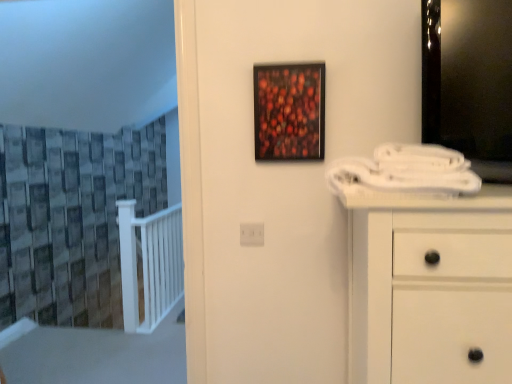
Question: Is white plastic electric outlet at center at the back of wooden-framed artwork at center?

Choices:
 (A) yes
 (B) no

Answer: (B)

Question: Is wooden-framed artwork at center wider than white plastic electric outlet at center?

Choices:
 (A) no
 (B) yes

Answer: (B)

Question: Is wooden-framed artwork at center thinner than white plastic electric outlet at center?

Choices:
 (A) no
 (B) yes

Answer: (A)

Question: Is wooden-framed artwork at center taller than white plastic electric outlet at center?

Choices:
 (A) no
 (B) yes

Answer: (B)

Question: From the image's perspective, is wooden-framed artwork at center beneath white plastic electric outlet at center?

Choices:
 (A) no
 (B) yes

Answer: (A)

Question: Do you think wooden-framed artwork at center is within white plastic electric outlet at center, or outside of it?

Choices:
 (A) outside
 (B) inside

Answer: (A)

Question: Considering the relative positions of wooden-framed artwork at center and white plastic electric outlet at center in the image provided, is wooden-framed artwork at center to the left or to the right of white plastic electric outlet at center?

Choices:
 (A) right
 (B) left

Answer: (A)

Question: Relative to white plastic electric outlet at center, is wooden-framed artwork at center in front or behind?

Choices:
 (A) behind
 (B) front

Answer: (B)

Question: Based on their sizes in the image, would you say wooden-framed artwork at center is bigger or smaller than white plastic electric outlet at center?

Choices:
 (A) small
 (B) big

Answer: (B)

Question: Which is correct: white plastic electric outlet at center is inside textured gray curtain at left, or outside of it?

Choices:
 (A) inside
 (B) outside

Answer: (B)

Question: Relative to textured gray curtain at left, is white plastic electric outlet at center in front or behind?

Choices:
 (A) front
 (B) behind

Answer: (B)

Question: From a real-world perspective, is white plastic electric outlet at center positioned above or below textured gray curtain at left?

Choices:
 (A) below
 (B) above

Answer: (A)

Question: Is white plastic electric outlet at center bigger or smaller than textured gray curtain at left?

Choices:
 (A) small
 (B) big

Answer: (A)

Question: Considering the relative positions of textured gray curtain at left and wooden-framed artwork at center in the image provided, is textured gray curtain at left to the left or to the right of wooden-framed artwork at center?

Choices:
 (A) right
 (B) left

Answer: (B)

Question: Relative to wooden-framed artwork at center, is textured gray curtain at left in front or behind?

Choices:
 (A) front
 (B) behind

Answer: (B)